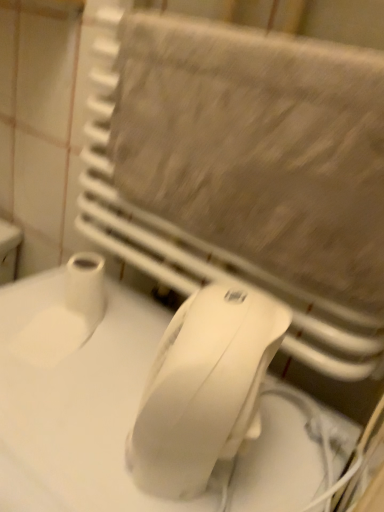
What do you see at coordinates (203, 388) in the screenshot? I see `white plastic mouse at center` at bounding box center [203, 388].

What is the approximate height of beige textured towel at upper center?

10.60 inches.

At what (x,y) coordinates should I click in order to perform the action: click on beige textured towel at upper center. Please return your answer as a coordinate pair (x, y). Image resolution: width=384 pixels, height=512 pixels. Looking at the image, I should click on (258, 148).

Locate an element on the screen. This screenshot has width=384, height=512. white matte countertop at lower left is located at coordinates (78, 407).

Image resolution: width=384 pixels, height=512 pixels. Identify the location of white plastic mouse at center. (203, 388).

From the picture: Considering the positions of objects white matte toilet paper at lower left and white matte countertop at lower left in the image provided, who is more to the left, white matte toilet paper at lower left or white matte countertop at lower left?

white matte countertop at lower left.

Is white matte countertop at lower left completely or partially inside white matte toilet paper at lower left?

No, white matte countertop at lower left is not surrounded by white matte toilet paper at lower left.

Could you tell me if white matte toilet paper at lower left is turned towards white matte countertop at lower left?

No, white matte toilet paper at lower left is not turned towards white matte countertop at lower left.

From a real-world perspective, does beige textured towel at upper center stand above white matte countertop at lower left?

Indeed, from a real-world perspective, beige textured towel at upper center stands above white matte countertop at lower left.

In the scene shown: How different are the orientations of beige textured towel at upper center and white matte countertop at lower left in degrees?

They differ by 1.37 degrees in their facing directions.

Between beige textured towel at upper center and white matte countertop at lower left, which one appears on the right side from the viewer's perspective?

beige textured towel at upper center is more to the right.

I want to click on bath towel on the right of white matte countertop at lower left, so click(258, 148).

From the image's perspective, which one is positioned higher, white matte toilet paper at lower left or beige textured towel at upper center?

From the image's view, beige textured towel at upper center is above.

Which point is more distant from viewer, (91, 277) or (191, 57)?

Positioned behind is point (91, 277).

Is white matte toilet paper at lower left taller than beige textured towel at upper center?

Result: No, white matte toilet paper at lower left is not taller than beige textured towel at upper center.

From the picture: Could you tell me if white matte toilet paper at lower left is facing beige textured towel at upper center?

No, white matte toilet paper at lower left is not oriented towards beige textured towel at upper center.

From a real-world perspective, which is physically below, white matte countertop at lower left or white plastic mouse at center?

Result: From a 3D spatial view, white matte countertop at lower left is below.

Are white matte countertop at lower left and white plastic mouse at center located far from each other?

No.

Is white matte countertop at lower left in front of or behind white plastic mouse at center in the image?

In the image, white matte countertop at lower left appears in front of white plastic mouse at center.

Based on the photo, from the image's perspective, which one is positioned lower, white matte countertop at lower left or white plastic mouse at center?

white matte countertop at lower left, from the image's perspective.

Considering the sizes of white matte countertop at lower left and beige textured towel at upper center in the image, is white matte countertop at lower left taller or shorter than beige textured towel at upper center?

Considering their sizes, white matte countertop at lower left has more height than beige textured towel at upper center.

From the image's perspective, is white matte countertop at lower left above or below beige textured towel at upper center?

From the image's perspective, white matte countertop at lower left appears below beige textured towel at upper center.

Is white matte countertop at lower left positioned beyond the bounds of beige textured towel at upper center?

Yes.

Is beige textured towel at upper center situated inside white plastic mouse at center or outside?

beige textured towel at upper center is not enclosed by white plastic mouse at center.

Is beige textured towel at upper center not near white plastic mouse at center?

Actually, beige textured towel at upper center and white plastic mouse at center are a little close together.

From the picture: Does beige textured towel at upper center have a greater height compared to white plastic mouse at center?

Indeed, beige textured towel at upper center has a greater height compared to white plastic mouse at center.

Is beige textured towel at upper center facing towards white plastic mouse at center?

No, beige textured towel at upper center is not turned towards white plastic mouse at center.

Does white matte countertop at lower left have a greater height compared to white matte toilet paper at lower left?

Yes.

From a real-world perspective, is white matte countertop at lower left positioned over white matte toilet paper at lower left based on gravity?

No.

Choose the correct answer: Is white matte countertop at lower left inside white matte toilet paper at lower left or outside it?

The correct answer is: outside.

Could you tell me if white matte countertop at lower left is turned towards white matte toilet paper at lower left?

No, white matte countertop at lower left is not aimed at white matte toilet paper at lower left.

Identify the location of counter top that is in front of the white matte toilet paper at lower left. (78, 407).

The height and width of the screenshot is (512, 384). Identify the location of counter top below the beige textured towel at upper center (from the image's perspective). (78, 407).

Estimate the real-world distances between objects in this image. Which object is closer to white matte countertop at lower left, white matte toilet paper at lower left or white plastic mouse at center?

Among the two, white plastic mouse at center is located nearer to white matte countertop at lower left.

Considering their positions, is beige textured towel at upper center positioned closer to white plastic mouse at center than white matte countertop at lower left?

white matte countertop at lower left.

Which object lies further to the anchor point white plastic mouse at center, white matte toilet paper at lower left or beige textured towel at upper center?

The object further to white plastic mouse at center is white matte toilet paper at lower left.

Which object lies nearer to the anchor point white plastic mouse at center, white matte toilet paper at lower left or white matte countertop at lower left?

white matte countertop at lower left is positioned closer to the anchor white plastic mouse at center.

Looking at the image, which one is located further to beige textured towel at upper center, white matte toilet paper at lower left or white matte countertop at lower left?

white matte toilet paper at lower left is positioned further to the anchor beige textured towel at upper center.

From the image, which object appears to be farther from beige textured towel at upper center, white matte toilet paper at lower left or white plastic mouse at center?

Among the two, white matte toilet paper at lower left is located further to beige textured towel at upper center.

Looking at the image, which one is located closer to white matte toilet paper at lower left, beige textured towel at upper center or white plastic mouse at center?

beige textured towel at upper center.

In the scene shown: Considering their positions, is white plastic mouse at center positioned closer to white matte toilet paper at lower left than beige textured towel at upper center?

beige textured towel at upper center is positioned closer to the anchor white matte toilet paper at lower left.

Find the location of `mouse that lies between white matte toilet paper at lower left and white matte countertop at lower left from top to bottom`. mouse that lies between white matte toilet paper at lower left and white matte countertop at lower left from top to bottom is located at coordinates (203, 388).

This screenshot has width=384, height=512. In order to click on mouse between beige textured towel at upper center and white matte countertop at lower left from top to bottom in this screenshot , I will do `click(203, 388)`.

I want to click on bath towel between white plastic mouse at center and white matte toilet paper at lower left from front to back, so click(258, 148).

You are a GUI agent. You are given a task and a screenshot of the screen. Output one action in this format:
    pyautogui.click(x=<x>, y=<y>)
    Task: Click on the toilet paper that lies between beige textured towel at upper center and white matte countertop at lower left from top to bottom
    The image size is (384, 512).
    Given the screenshot: What is the action you would take?
    pyautogui.click(x=86, y=286)